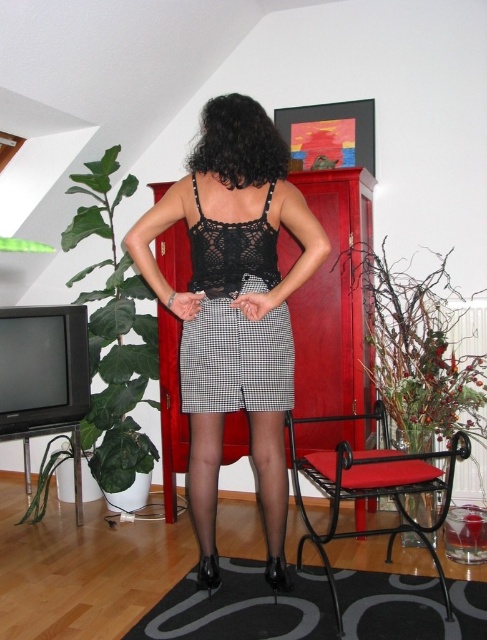
Can you confirm if black lace dress at center is taller than black metal chair at lower right?

Correct, black lace dress at center is much taller as black metal chair at lower right.

Is black lace dress at center shorter than black metal chair at lower right?

No.

What are the coordinates of `black lace dress at center` in the screenshot? It's located at (235, 321).

Where is `black lace dress at center`? This screenshot has width=487, height=640. black lace dress at center is located at coordinates (235, 321).

Between black mesh top at center and black lace dress at center, which one is positioned higher?

black lace dress at center is higher up.

Can you confirm if black mesh top at center is thinner than black lace dress at center?

Incorrect, black mesh top at center's width is not less than black lace dress at center's.

Does point (219, 208) come closer to viewer compared to point (263, 324)?

Yes, point (219, 208) is in front of point (263, 324).

I want to click on black mesh top at center, so click(x=235, y=307).

Who is higher up, black mesh top at center or black metal chair at lower right?

black mesh top at center is above.

Is black mesh top at center positioned behind black metal chair at lower right?

Yes, black mesh top at center is behind black metal chair at lower right.

The image size is (487, 640). What do you see at coordinates (235, 307) in the screenshot?
I see `black mesh top at center` at bounding box center [235, 307].

You are a GUI agent. You are given a task and a screenshot of the screen. Output one action in this format:
    pyautogui.click(x=<x>, y=<y>)
    Task: Click on the black mesh top at center
    
    Given the screenshot: What is the action you would take?
    pyautogui.click(x=235, y=307)